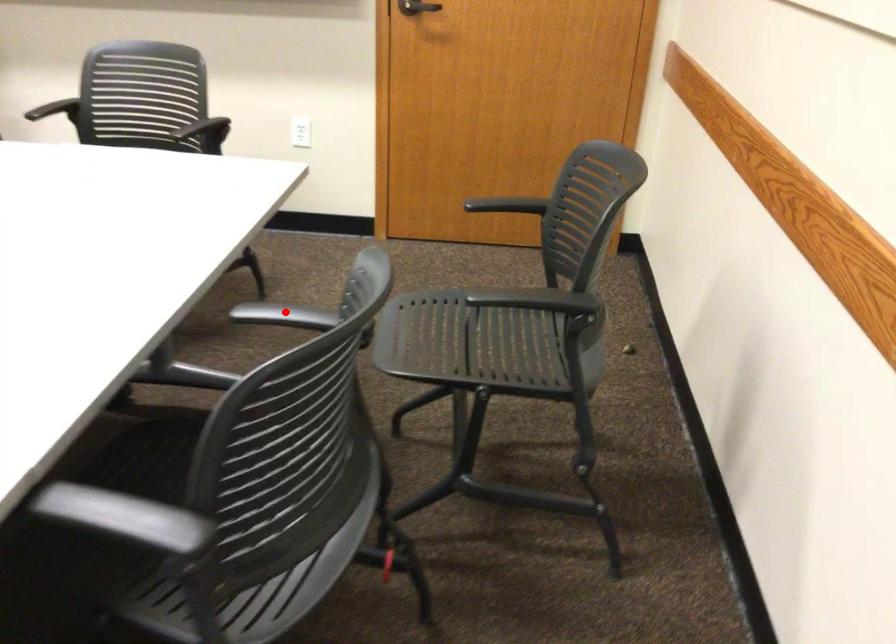
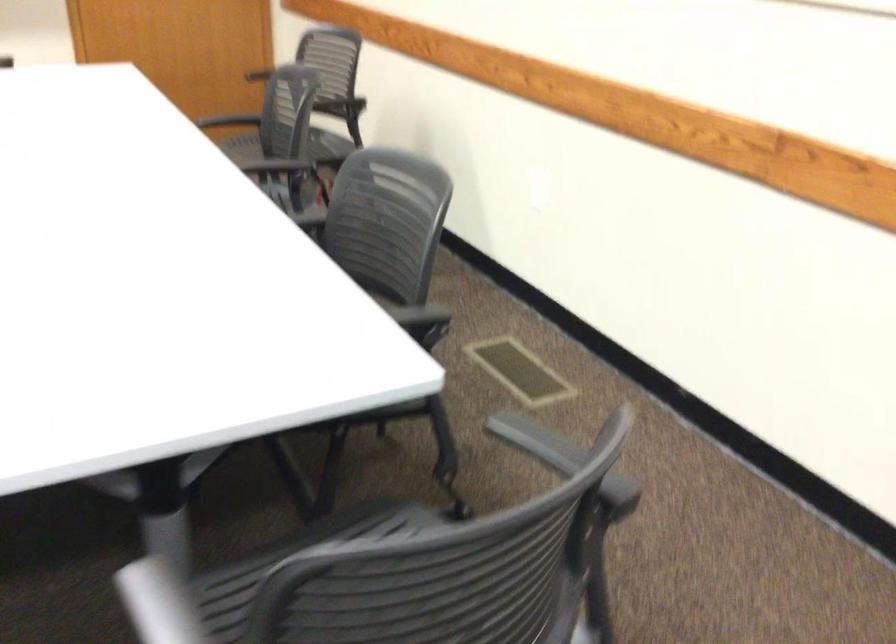
Locate, in the second image, the point that corresponds to the highlighted location in the first image.

(228, 120)